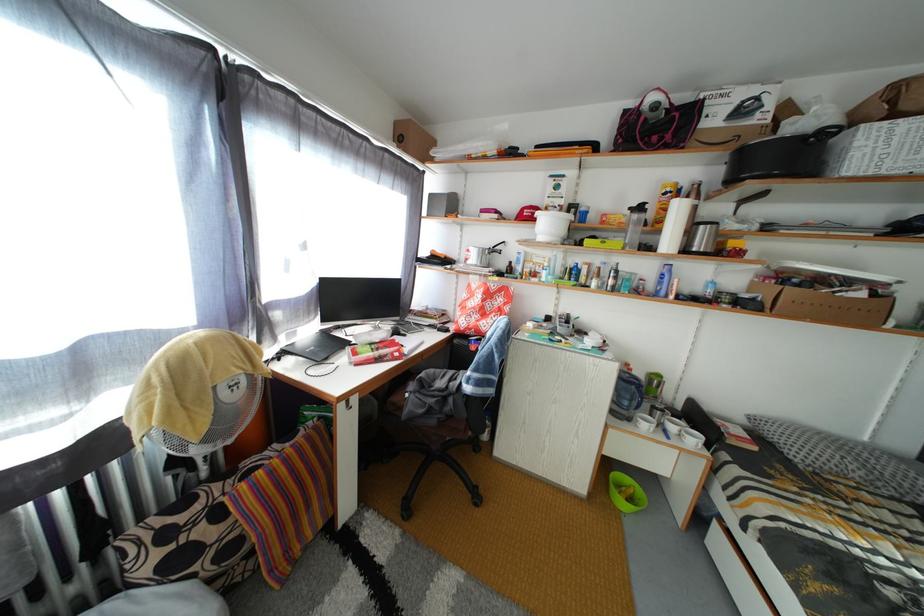
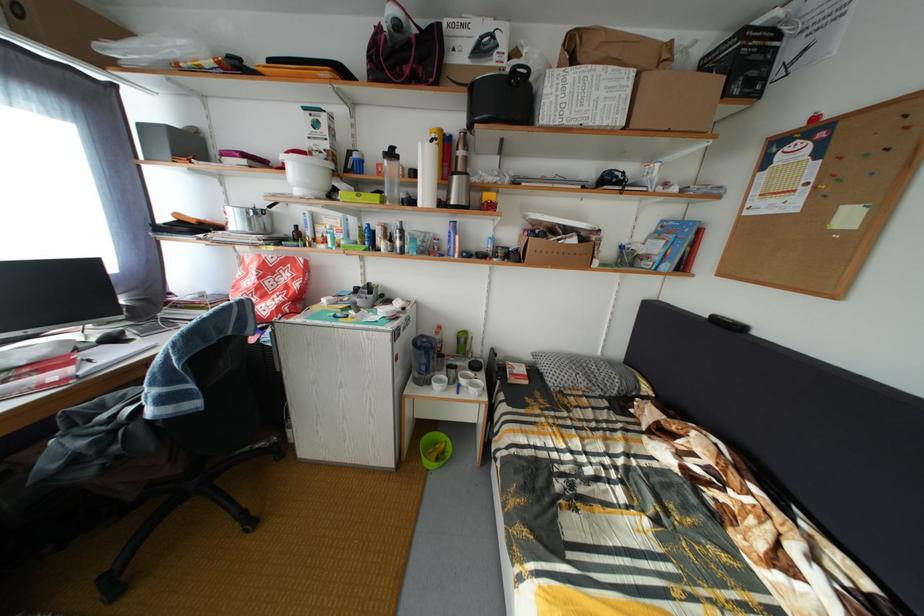
The point at [638,426] is marked in the first image. Where is the corresponding point in the second image?

(438, 390)